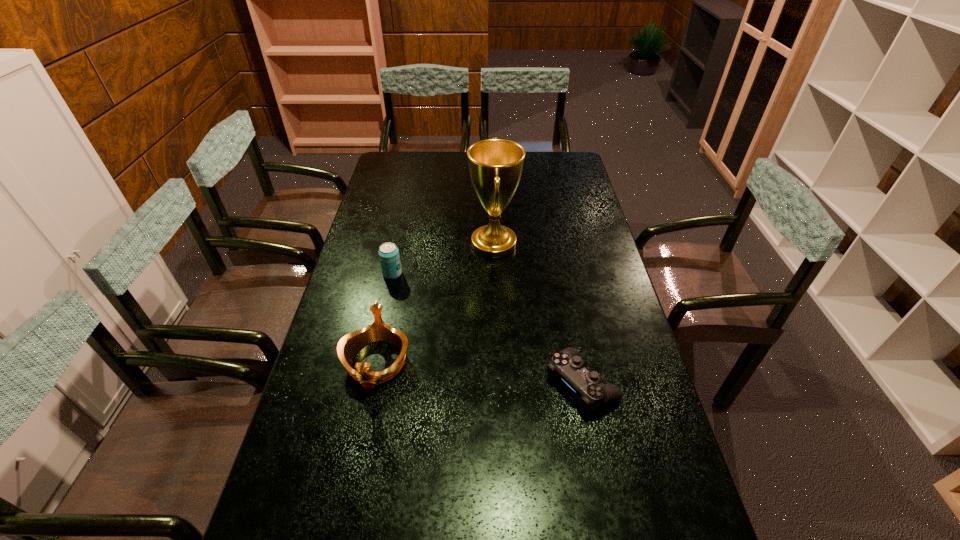
Where is `vacant space in between the tiara and the tallest object`? vacant space in between the tiara and the tallest object is located at coordinates (435, 303).

At what (x,y) coordinates should I click in order to perform the action: click on vacant space that is in between the beer can and the award. Please return your answer as a coordinate pair (x, y). Looking at the image, I should click on (444, 259).

The height and width of the screenshot is (540, 960). What are the coordinates of `free spot between the award and the tiara` in the screenshot? It's located at (435, 303).

Where is `free point between the tiara and the second object from right to left`? The image size is (960, 540). free point between the tiara and the second object from right to left is located at coordinates (435, 303).

The image size is (960, 540). Identify the location of free space between the beer can and the award. (444, 259).

Where is `empty space that is in between the shortest object and the tiara`? The image size is (960, 540). empty space that is in between the shortest object and the tiara is located at coordinates (479, 373).

The image size is (960, 540). In order to click on vacant space in between the shortest object and the tallest object in this screenshot , I will do `click(538, 314)`.

This screenshot has height=540, width=960. Identify the location of vacant area that lies between the beer can and the shortest object. (487, 328).

Where is `vacant space that is in between the tallest object and the tiara`? vacant space that is in between the tallest object and the tiara is located at coordinates (435, 303).

Identify which object is the third closest to the rightmost object. Please provide its 2D coordinates. Your answer should be formatted as a tuple, i.e. [(x, y)], where the tuple contains the x and y coordinates of a point satisfying the conditions above.

[(389, 256)]